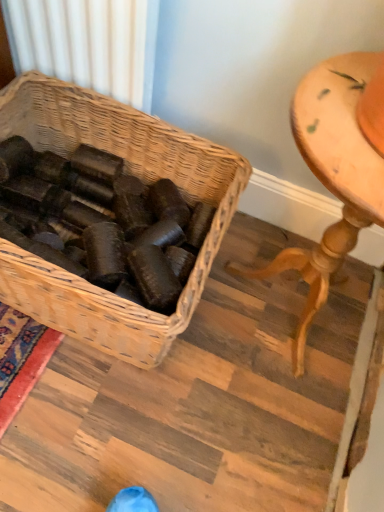
Question: Can you confirm if wooden table at right is smaller than woven brown picnic basket at center?

Choices:
 (A) no
 (B) yes

Answer: (B)

Question: From the image's perspective, would you say wooden table at right is shown under woven brown picnic basket at center?

Choices:
 (A) yes
 (B) no

Answer: (A)

Question: Is wooden table at right to the left of woven brown picnic basket at center from the viewer's perspective?

Choices:
 (A) no
 (B) yes

Answer: (A)

Question: Does wooden table at right have a greater height compared to woven brown picnic basket at center?

Choices:
 (A) no
 (B) yes

Answer: (B)

Question: Is wooden table at right wider than woven brown picnic basket at center?

Choices:
 (A) yes
 (B) no

Answer: (B)

Question: Considering the relative sizes of wooden table at right and woven brown picnic basket at center in the image provided, is wooden table at right shorter than woven brown picnic basket at center?

Choices:
 (A) yes
 (B) no

Answer: (B)

Question: Is woven brown picnic basket at center not close to wooden table at right?

Choices:
 (A) no
 (B) yes

Answer: (A)

Question: Could you tell me if woven brown picnic basket at center is turned towards wooden table at right?

Choices:
 (A) no
 (B) yes

Answer: (A)

Question: Is woven brown picnic basket at center looking in the opposite direction of wooden table at right?

Choices:
 (A) no
 (B) yes

Answer: (A)

Question: From the image's perspective, is woven brown picnic basket at center beneath wooden table at right?

Choices:
 (A) yes
 (B) no

Answer: (B)

Question: Would you say woven brown picnic basket at center is outside wooden table at right?

Choices:
 (A) yes
 (B) no

Answer: (A)

Question: Is woven brown picnic basket at center wider than wooden table at right?

Choices:
 (A) yes
 (B) no

Answer: (A)

Question: From the image's perspective, relative to wooden table at right, is woven brown picnic basket at center above or below?

Choices:
 (A) below
 (B) above

Answer: (B)